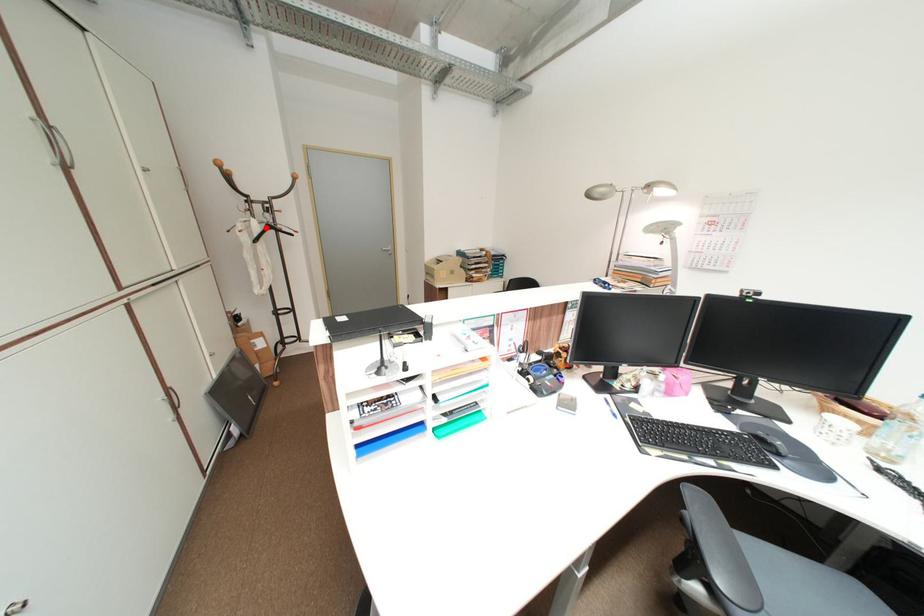
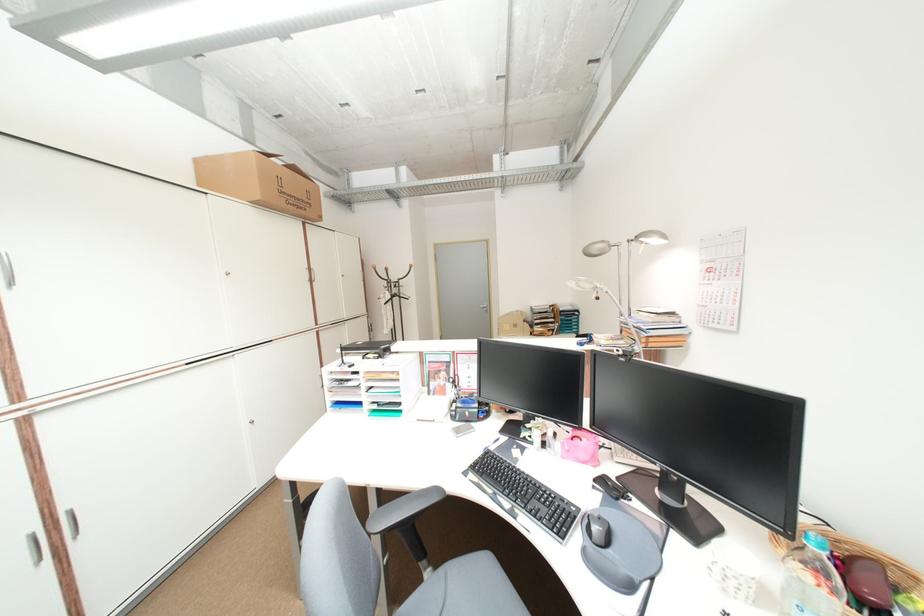
The point at the highlighted location is marked in the first image. Where is the corresponding point in the second image?

(397, 296)